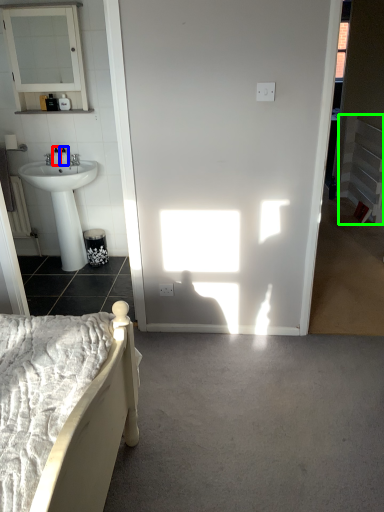
Question: Which is nearer to the toiletry (highlighted by a red box)? toiletry (highlighted by a blue box) or balustrade (highlighted by a green box).

Choices:
 (A) toiletry
 (B) balustrade

Answer: (A)